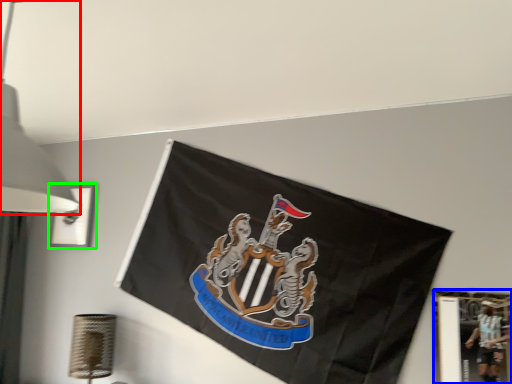
Question: Which object is positioned farthest from lamp (highlighted by a red box)? Select from picture frame (highlighted by a blue box) and picture frame (highlighted by a green box).

Choices:
 (A) picture frame
 (B) picture frame

Answer: (B)